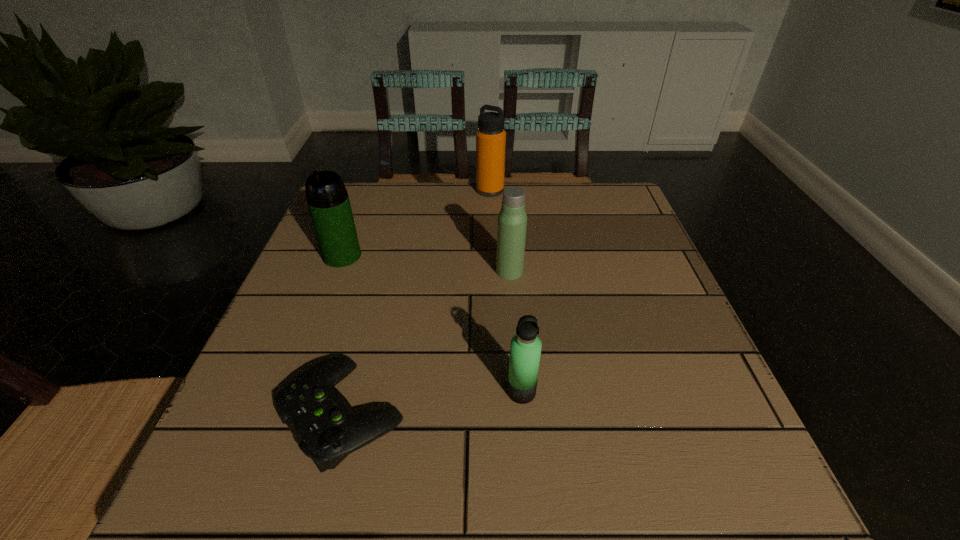
Where is `the farthest object`? The height and width of the screenshot is (540, 960). the farthest object is located at coordinates (490, 137).

The height and width of the screenshot is (540, 960). In order to click on the leftmost thermos bottle in this screenshot , I will do `click(327, 198)`.

I want to click on the nearest thermos bottle, so click(525, 349).

Where is `the shortest object`? the shortest object is located at coordinates pyautogui.click(x=321, y=419).

Image resolution: width=960 pixels, height=540 pixels. I want to click on free location located on the left of the farthest object, so click(367, 191).

Locate an element on the screen. The image size is (960, 540). vacant space located from the spout of the leftmost thermos bottle is located at coordinates (321, 313).

What are the coordinates of `free space located on the right of the nearest thermos bottle` in the screenshot? It's located at (672, 392).

Find the location of a particular element. vacant area situated on the back of the shortest object is located at coordinates (384, 255).

This screenshot has width=960, height=540. I want to click on object situated at the far edge, so click(x=490, y=137).

I want to click on object at the near edge, so click(321, 419).